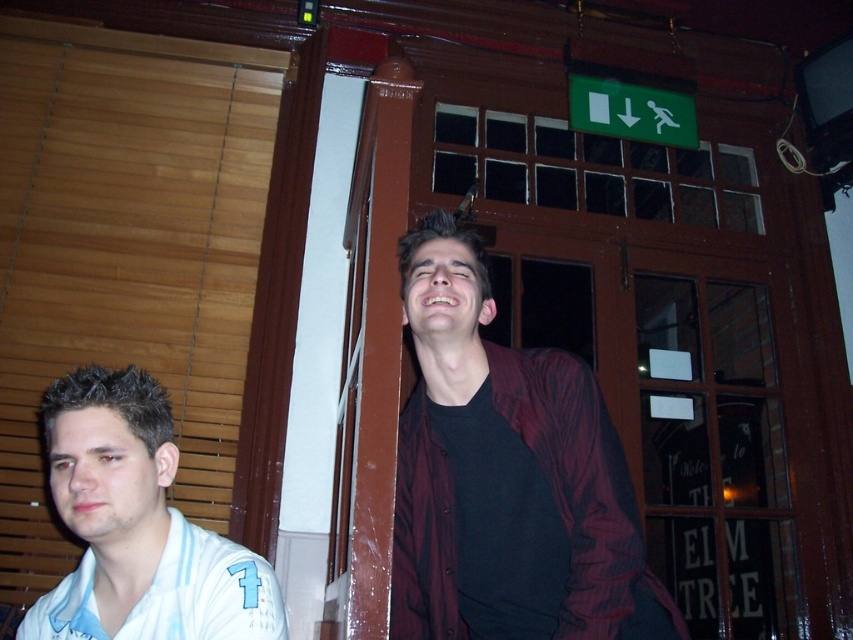
You are standing in the bar and want to hand a drink to the person wearing the dark maroon jacket at center. Where should you walk to in order to reach them?

The dark maroon jacket at center is located at point (506,477), so you should walk towards that coordinate to reach them.

You are at a bar and want to order a drink. You see a white striped shirt at left and a white jersey at left. Which one is closer to the entrance?

The white striped shirt at left is closer to the entrance because it is positioned to the left of the white jersey at left, and the entrance is likely through the wooden door with glass panels mentioned in the scene description.